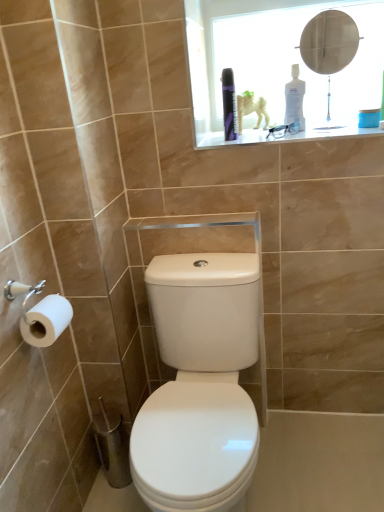
Based on the photo, what is the approximate width of metallic round mirror at upper center?

metallic round mirror at upper center is 4.87 inches wide.

What do you see at coordinates (229, 105) in the screenshot? I see `purple glossy can at upper center, which appears as the 2th toiletry when viewed from the right` at bounding box center [229, 105].

Image resolution: width=384 pixels, height=512 pixels. What do you see at coordinates (294, 99) in the screenshot?
I see `white plastic bottle at upper center, the second toiletry when ordered from left to right` at bounding box center [294, 99].

The width and height of the screenshot is (384, 512). Identify the location of metallic round mirror at upper center. pyautogui.click(x=329, y=44).

Based on the photo, can you confirm if white plastic bottle at upper center, the second toiletry when ordered from left to right, is smaller than white matte toilet paper at left?

Incorrect, white plastic bottle at upper center, the second toiletry when ordered from left to right, is not smaller in size than white matte toilet paper at left.

Is white matte toilet paper at left inside white plastic bottle at upper center, positioned as the first toiletry in right-to-left order?

→ No, white matte toilet paper at left is not a part of white plastic bottle at upper center, positioned as the first toiletry in right-to-left order.

From the image's perspective, is white plastic bottle at upper center, positioned as the first toiletry in right-to-left order, above or below white matte toilet paper at left?

From the image's perspective, white plastic bottle at upper center, positioned as the first toiletry in right-to-left order, appears above white matte toilet paper at left.

Which is more to the right, white plastic bottle at upper center, positioned as the first toiletry in right-to-left order, or white matte toilet paper at left?

white plastic bottle at upper center, positioned as the first toiletry in right-to-left order.

From a real-world perspective, is white matte toilet paper at left positioned above or below metallic round mirror at upper center?

white matte toilet paper at left is below metallic round mirror at upper center.

Is white matte toilet paper at left aimed at metallic round mirror at upper center?

No, white matte toilet paper at left does not turn towards metallic round mirror at upper center.

Considering the points (47, 315) and (354, 25), which point is in front, point (47, 315) or point (354, 25)?

The point (47, 315) is more forward.

Find the location of a particular element. The image size is (384, 512). toilet paper on the left side of metallic round mirror at upper center is located at coordinates (46, 321).

Does metallic round mirror at upper center have a lesser height compared to white matte toilet paper at left?

No, metallic round mirror at upper center is not shorter than white matte toilet paper at left.

How far apart are metallic round mirror at upper center and white matte toilet paper at left?

They are 3.94 feet apart.

Which object is positioned more to the right, white matte toilet paper at left or purple glossy can at upper center, which appears as the 2th toiletry when viewed from the right?

purple glossy can at upper center, which appears as the 2th toiletry when viewed from the right, is more to the right.

Where is `toilet paper in front of the purple glossy can at upper center, which appears as the 2th toiletry when viewed from the right`? The width and height of the screenshot is (384, 512). toilet paper in front of the purple glossy can at upper center, which appears as the 2th toiletry when viewed from the right is located at coordinates (46, 321).

From a real-world perspective, between white matte toilet paper at left and purple glossy can at upper center, which appears as the 2th toiletry when viewed from the right, who is vertically higher?

From a 3D spatial view, purple glossy can at upper center, which appears as the 2th toiletry when viewed from the right, is above.

Consider the image. From the image's perspective, between white matte toilet paper at left and purple glossy can at upper center, which appears as the 2th toiletry when viewed from the right, which one is located above?

purple glossy can at upper center, which appears as the 2th toiletry when viewed from the right, appears higher in the image.

From a real-world perspective, is metallic round mirror at upper center above or below white plastic bottle at upper center, positioned as the first toiletry in right-to-left order?

In terms of real-world spatial position, metallic round mirror at upper center is above white plastic bottle at upper center, positioned as the first toiletry in right-to-left order.

Between metallic round mirror at upper center and white plastic bottle at upper center, the second toiletry when ordered from left to right, which one is positioned behind?

white plastic bottle at upper center, the second toiletry when ordered from left to right, is more distant.

Identify the location of mirror lying above the white plastic bottle at upper center, positioned as the first toiletry in right-to-left order (from the image's perspective). (329, 44).

Which is farther, (x=328, y=25) or (x=302, y=116)?

The point (x=302, y=116) is farther.

From a real-world perspective, does purple glossy can at upper center, which is the first toiletry from left to right, stand above white plastic bottle at upper center, positioned as the first toiletry in right-to-left order?

Correct, in the physical world, purple glossy can at upper center, which is the first toiletry from left to right, is higher than white plastic bottle at upper center, positioned as the first toiletry in right-to-left order.

Does purple glossy can at upper center, which appears as the 2th toiletry when viewed from the right, appear on the left side of white plastic bottle at upper center, positioned as the first toiletry in right-to-left order?

Yes, purple glossy can at upper center, which appears as the 2th toiletry when viewed from the right, is to the left of white plastic bottle at upper center, positioned as the first toiletry in right-to-left order.

Considering the positions of objects purple glossy can at upper center, which appears as the 2th toiletry when viewed from the right, and white plastic bottle at upper center, the second toiletry when ordered from left to right, in the image provided, who is in front, purple glossy can at upper center, which appears as the 2th toiletry when viewed from the right, or white plastic bottle at upper center, the second toiletry when ordered from left to right,?

purple glossy can at upper center, which appears as the 2th toiletry when viewed from the right, is more forward.

Between purple glossy can at upper center, which is the first toiletry from left to right, and white plastic bottle at upper center, positioned as the first toiletry in right-to-left order, which one has smaller size?

Smaller between the two is purple glossy can at upper center, which is the first toiletry from left to right.

Is white plastic bottle at upper center, positioned as the first toiletry in right-to-left order, outside of transparent plastic medicine cabinet at upper center?

Yes, white plastic bottle at upper center, positioned as the first toiletry in right-to-left order, is outside of transparent plastic medicine cabinet at upper center.

In order to click on medicine cabinet on the right of the white plastic bottle at upper center, positioned as the first toiletry in right-to-left order in this screenshot , I will do `click(286, 65)`.

Which is farther, [288,100] or [298,114]?

Point [298,114]

Is the depth of white plastic bottle at upper center, positioned as the first toiletry in right-to-left order, less than that of transparent plastic medicine cabinet at upper center?

No, it is behind transparent plastic medicine cabinet at upper center.

I want to click on toilet paper in front of the white plastic bottle at upper center, the second toiletry when ordered from left to right, so click(46, 321).

Find the location of `toilet paper below the metallic round mirror at upper center (from a real-world perspective)`. toilet paper below the metallic round mirror at upper center (from a real-world perspective) is located at coordinates (46, 321).

Considering their positions, is purple glossy can at upper center, which appears as the 2th toiletry when viewed from the right, positioned closer to white plastic bottle at upper center, the second toiletry when ordered from left to right, than white matte toilet paper at left?

Based on the image, purple glossy can at upper center, which appears as the 2th toiletry when viewed from the right, appears to be nearer to white plastic bottle at upper center, the second toiletry when ordered from left to right.

When comparing their distances from white plastic bottle at upper center, the second toiletry when ordered from left to right, does metallic round mirror at upper center or white matte toilet paper at left seem closer?

The object closer to white plastic bottle at upper center, the second toiletry when ordered from left to right, is metallic round mirror at upper center.

In the scene shown: Considering their positions, is metallic round mirror at upper center positioned closer to transparent plastic medicine cabinet at upper center than white plastic bottle at upper center, positioned as the first toiletry in right-to-left order?

The object closer to transparent plastic medicine cabinet at upper center is metallic round mirror at upper center.

From the picture: Looking at the image, which one is located closer to purple glossy can at upper center, which is the first toiletry from left to right, metallic round mirror at upper center or transparent plastic medicine cabinet at upper center?

transparent plastic medicine cabinet at upper center is closer to purple glossy can at upper center, which is the first toiletry from left to right.

Based on their spatial positions, is transparent plastic medicine cabinet at upper center or purple glossy can at upper center, which appears as the 2th toiletry when viewed from the right, closer to white plastic bottle at upper center, positioned as the first toiletry in right-to-left order?

The object closer to white plastic bottle at upper center, positioned as the first toiletry in right-to-left order, is transparent plastic medicine cabinet at upper center.

Looking at the image, which one is located closer to white matte toilet paper at left, purple glossy can at upper center, which is the first toiletry from left to right, or metallic round mirror at upper center?

The object closer to white matte toilet paper at left is purple glossy can at upper center, which is the first toiletry from left to right.

Based on their spatial positions, is purple glossy can at upper center, which is the first toiletry from left to right, or white plastic bottle at upper center, positioned as the first toiletry in right-to-left order, further from white matte toilet paper at left?

Based on the image, white plastic bottle at upper center, positioned as the first toiletry in right-to-left order, appears to be further to white matte toilet paper at left.

Estimate the real-world distances between objects in this image. Which object is closer to metallic round mirror at upper center, white plastic bottle at upper center, positioned as the first toiletry in right-to-left order, or purple glossy can at upper center, which appears as the 2th toiletry when viewed from the right?

Among the two, white plastic bottle at upper center, positioned as the first toiletry in right-to-left order, is located nearer to metallic round mirror at upper center.

You are a GUI agent. You are given a task and a screenshot of the screen. Output one action in this format:
    pyautogui.click(x=<x>, y=<y>)
    Task: Click on the medicine cabinet between purple glossy can at upper center, which is the first toiletry from left to right, and metallic round mirror at upper center
    This screenshot has width=384, height=512.
    Given the screenshot: What is the action you would take?
    pyautogui.click(x=286, y=65)

I want to click on toiletry between white plastic bottle at upper center, positioned as the first toiletry in right-to-left order, and white matte toilet paper at left vertically, so click(229, 105).

Where is `mirror between transparent plastic medicine cabinet at upper center and white plastic bottle at upper center, the second toiletry when ordered from left to right, vertically`? The width and height of the screenshot is (384, 512). mirror between transparent plastic medicine cabinet at upper center and white plastic bottle at upper center, the second toiletry when ordered from left to right, vertically is located at coordinates (329, 44).

Locate an element on the screen. The height and width of the screenshot is (512, 384). toiletry between purple glossy can at upper center, which is the first toiletry from left to right, and transparent plastic medicine cabinet at upper center is located at coordinates (294, 99).